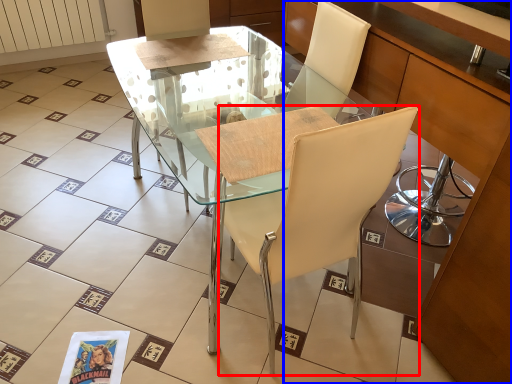
Question: Which point is closer to the camera, chair (highlighted by a red box) or cabinetry (highlighted by a blue box)?

Choices:
 (A) chair
 (B) cabinetry

Answer: (A)